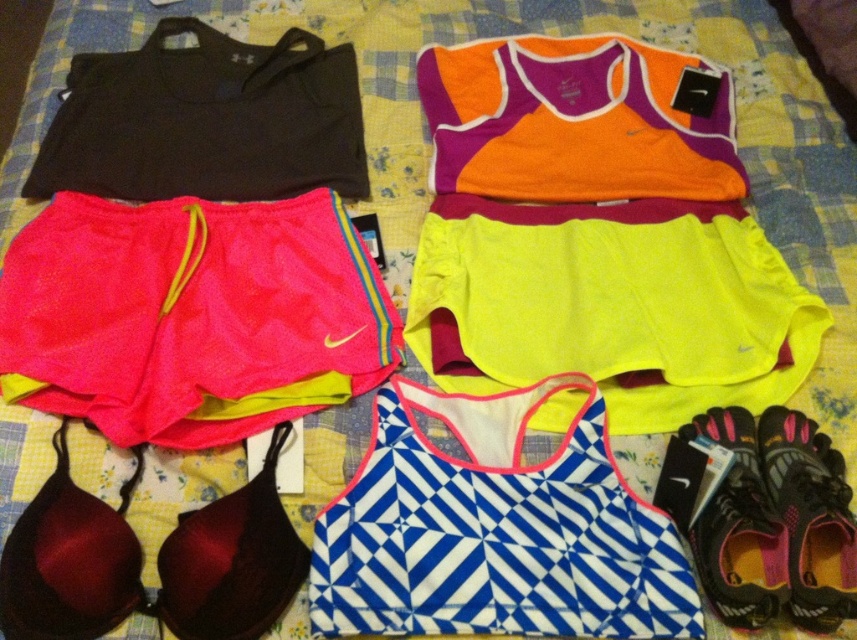
You are standing at the point labeled point (15, 397) and want to pick up an item from the bedspread. The bedspread is 80 inches long. Can you reach the end of the bedspread from your current position?

The distance between point (15, 397) and the viewer is 33.50 inches. Since the bedspread is 80 inches long, you can reach the end of the bedspread from your current position as 33.50 inches is less than half of 80 inches.

Looking at this image, you are organizing a drawer and need to place the pink mesh shorts at lower left and the blue and white geometric sports bra at center. The drawer has a width of 10 inches. Can both items fit side by side without overlapping?

The distance between the pink mesh shorts at lower left and the blue and white geometric sports bra at center is 8.93 inches. Since the drawer is 10 inches wide, there is enough space to place them side by side without overlapping.

You are organizing a sports equipment closet and need to determine which of the two pairs of shorts, the pink mesh shorts at lower left or the black fabric shorts at upper left, requires more storage space. Based on their sizes, which one should you allocate more space to?

The pink mesh shorts at lower left has a larger size compared to the black fabric shorts at upper left, so you should allocate more storage space to the pink mesh shorts at lower left.